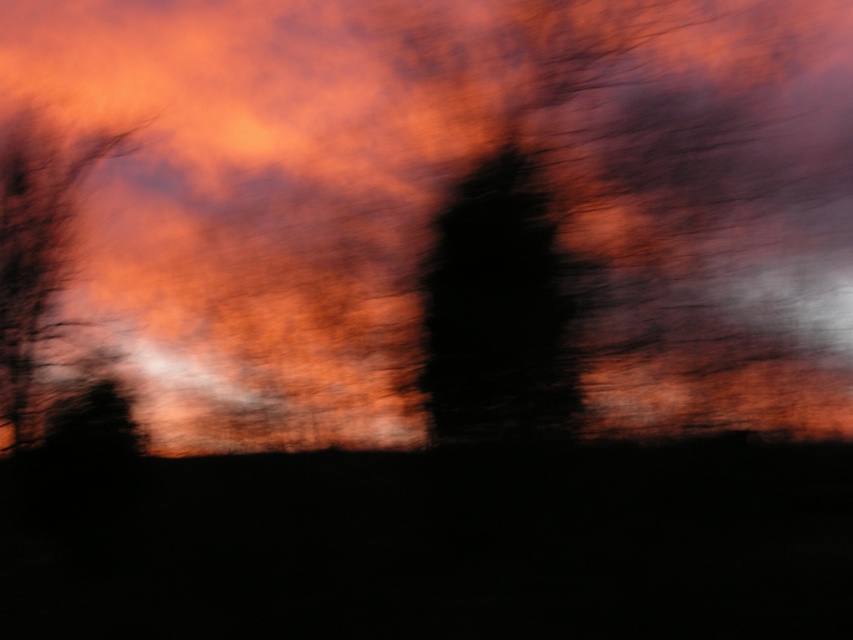
You are holding a camera and want to take a clearer photo of the black matte tree at center. Given that you are currently 20.99 feet away from the tree, is this distance within the optimal focus range of a standard camera lens, which is typically between 10 to 30 feet?

The black matte tree at center and camera are 20.99 feet apart from each other. Since the optimal focus range of a standard camera lens is between 10 to 30 feet, 20.99 feet falls within this range. Therefore, you can take a clearer photo of the black matte tree at center from your current position.